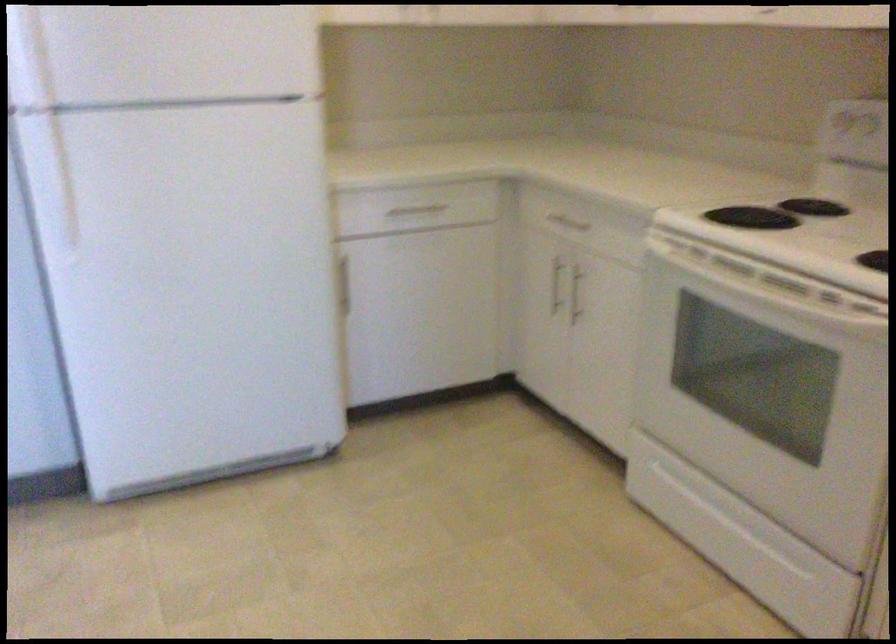
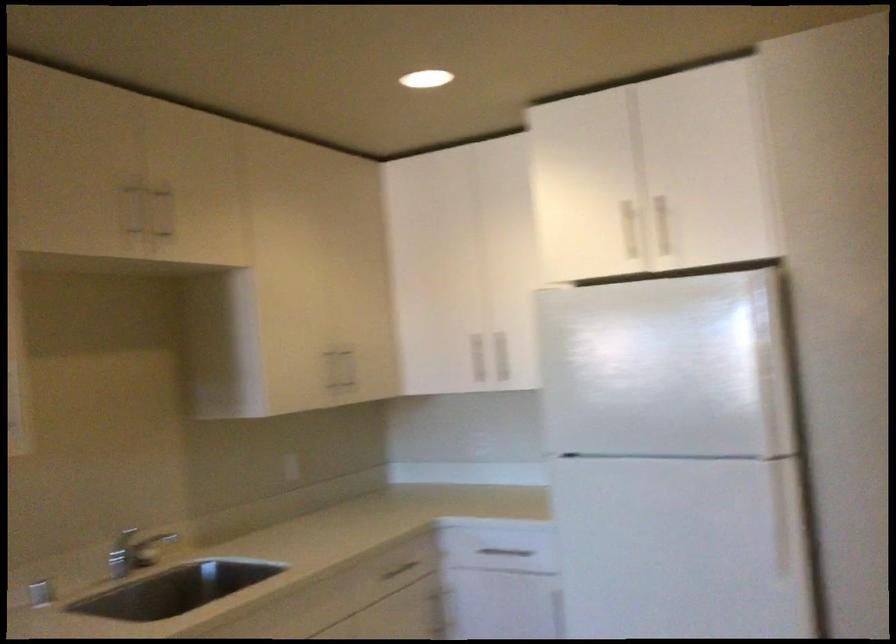
Question: The images are taken continuously from a first-person perspective. In which direction is your viewpoint rotating?

Choices:
 (A) Left
 (B) Right
 (C) Up
 (D) Down

Answer: (A)